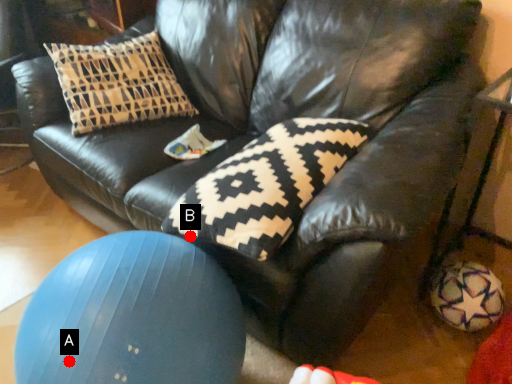
Question: Two points are circled on the image, labeled by A and B beside each circle. Among these points, which one is farthest from the camera?

Choices:
 (A) A is further
 (B) B is further

Answer: (B)